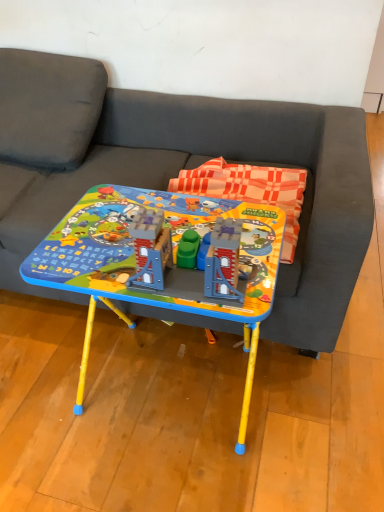
Find the location of a particular element. matte plastic table at center is located at coordinates (158, 261).

Describe the element at coordinates (158, 261) in the screenshot. I see `matte plastic table at center` at that location.

Find the location of a particular element. This screenshot has width=384, height=512. dark gray fabric couch at center is located at coordinates (181, 168).

This screenshot has width=384, height=512. What do you see at coordinates (181, 168) in the screenshot?
I see `dark gray fabric couch at center` at bounding box center [181, 168].

Where is `matte plastic table at center`? The height and width of the screenshot is (512, 384). matte plastic table at center is located at coordinates (158, 261).

Between dark gray fabric couch at center and matte plastic table at center, which one appears on the right side from the viewer's perspective?

matte plastic table at center.

Which is in front, dark gray fabric couch at center or matte plastic table at center?

matte plastic table at center is closer to the camera.

Is point (328, 112) farther from camera compared to point (264, 295)?

Yes.

From the image's perspective, which one is positioned lower, dark gray fabric couch at center or matte plastic table at center?

matte plastic table at center, from the image's perspective.

From a real-world perspective, is dark gray fabric couch at center located higher than matte plastic table at center?

Yes, from a real-world perspective, dark gray fabric couch at center is above matte plastic table at center.

Considering the sizes of objects dark gray fabric couch at center and matte plastic table at center in the image provided, who is thinner, dark gray fabric couch at center or matte plastic table at center?

Thinner between the two is matte plastic table at center.

Who is shorter, dark gray fabric couch at center or matte plastic table at center?

With less height is matte plastic table at center.

Which of these two, dark gray fabric couch at center or matte plastic table at center, is smaller?

Smaller between the two is matte plastic table at center.

Can matte plastic table at center be found inside dark gray fabric couch at center?

Yes, matte plastic table at center is inside dark gray fabric couch at center.

Is dark gray fabric couch at center far from matte plastic table at center?

No, there isn't a large distance between dark gray fabric couch at center and matte plastic table at center.

Consider the image. Could you tell me if dark gray fabric couch at center is turned towards matte plastic table at center?

Yes, dark gray fabric couch at center is facing matte plastic table at center.

How different are the orientations of dark gray fabric couch at center and matte plastic table at center in degrees?

0.000799 degrees separate the facing orientations of dark gray fabric couch at center and matte plastic table at center.

Measure the distance from dark gray fabric couch at center to matte plastic table at center.

dark gray fabric couch at center and matte plastic table at center are 15.62 inches apart.

Where is `studio couch above the matte plastic table at center (from a real-world perspective)`? studio couch above the matte plastic table at center (from a real-world perspective) is located at coordinates (181, 168).

Would you say matte plastic table at center is to the left or to the right of dark gray fabric couch at center in the picture?

From the image, it's evident that matte plastic table at center is to the right of dark gray fabric couch at center.

Which object is further away from the camera taking this photo, matte plastic table at center or dark gray fabric couch at center?

dark gray fabric couch at center is behind.

Is point (22, 266) positioned in front of point (353, 115)?

That is True.

From the image's perspective, is matte plastic table at center located above or below dark gray fabric couch at center?

Clearly, from the image's perspective, matte plastic table at center is below dark gray fabric couch at center.

From a real-world perspective, is matte plastic table at center on top of dark gray fabric couch at center?

No, from a real-world perspective, matte plastic table at center is not above dark gray fabric couch at center.

In the scene shown: Looking at their sizes, would you say matte plastic table at center is wider or thinner than dark gray fabric couch at center?

Considering their sizes, matte plastic table at center looks slimmer than dark gray fabric couch at center.

Who is taller, matte plastic table at center or dark gray fabric couch at center?

dark gray fabric couch at center.

Consider the image. Is matte plastic table at center bigger than dark gray fabric couch at center?

No.

Is matte plastic table at center completely or partially outside of dark gray fabric couch at center?

matte plastic table at center lies outside dark gray fabric couch at center's area.

In the scene shown: Are matte plastic table at center and dark gray fabric couch at center located far from each other?

That's not correct — matte plastic table at center is a little close to dark gray fabric couch at center.

Is matte plastic table at center positioned with its back to dark gray fabric couch at center?

Yes, dark gray fabric couch at center is at the back of matte plastic table at center.

How distant is matte plastic table at center from dark gray fabric couch at center?

The distance of matte plastic table at center from dark gray fabric couch at center is 15.62 inches.

Locate an element on the screen. This screenshot has height=512, width=384. table to the right of dark gray fabric couch at center is located at coordinates (158, 261).

The height and width of the screenshot is (512, 384). I want to click on table below the dark gray fabric couch at center (from the image's perspective), so click(158, 261).

You are a GUI agent. You are given a task and a screenshot of the screen. Output one action in this format:
    pyautogui.click(x=<x>, y=<y>)
    Task: Click on the studio couch that appears on the left of matte plastic table at center
    
    Given the screenshot: What is the action you would take?
    pyautogui.click(x=181, y=168)